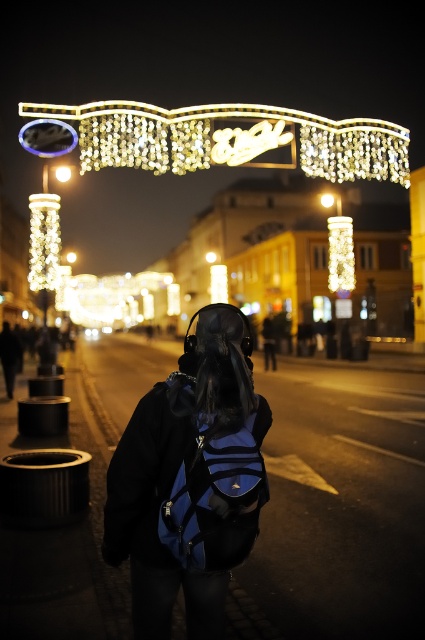
You are a photographer standing on the street. You want to take a photo of the blue fabric backpack at center and the iridescent glass arch at upper center. Which object should you focus on to ensure both are in sharp focus?

To ensure both the blue fabric backpack at center and the irridescent glass arch at upper center are in sharp focus, focus on the blue fabric backpack at center since it is closer to the camera than the arch.

You are a photographer trying to capture the blue fabric backpack at center and the illuminated glass column at left in the same frame. Based on their positions, which object should you focus on to ensure both are in focus?

To ensure both the blue fabric backpack at center and the illuminated glass column at left are in focus, you should focus on the blue fabric backpack at center since it is closer to the viewer. This will allow the illuminated glass column at left, which is further away, to remain within the depth of field.

You are a photographer trying to capture the blue fabric backpack at center and the iridescent glass arch at upper center in the same frame. Based on their sizes, which object would appear larger in your photo?

The blue fabric backpack at center would appear larger in the photo since it is taller than the iridescent glass arch at upper center.